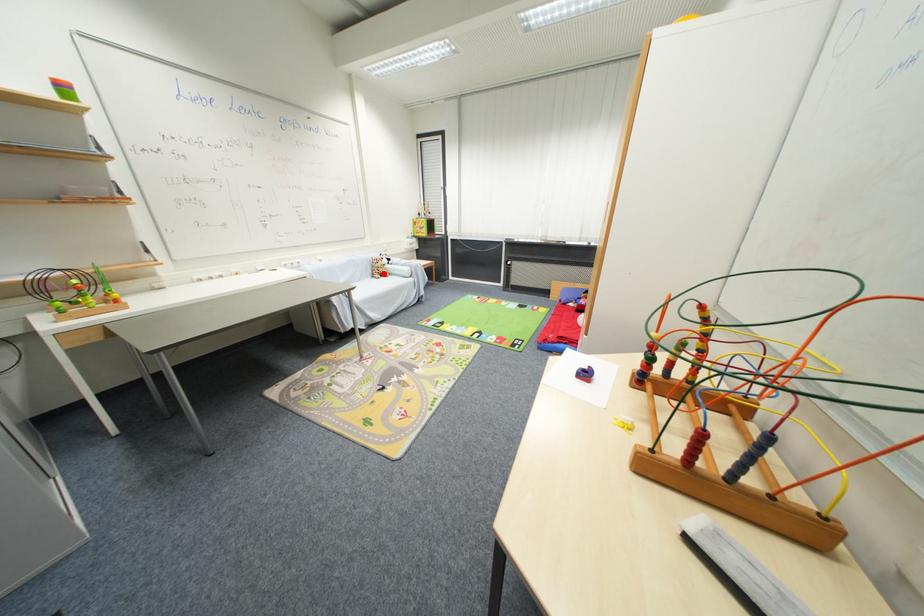
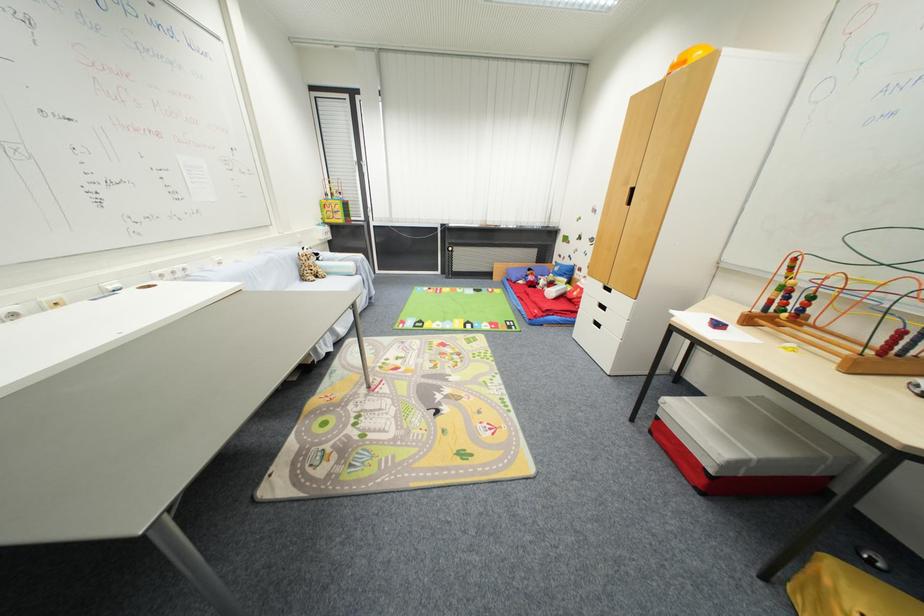
In the second image, find the point that corresponds to the highlighted location in the first image.

(313, 274)